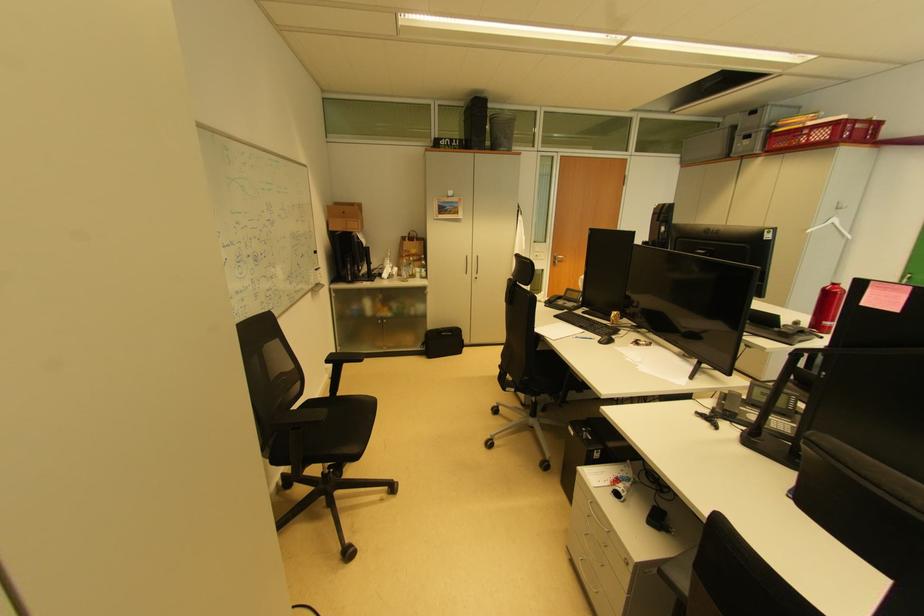
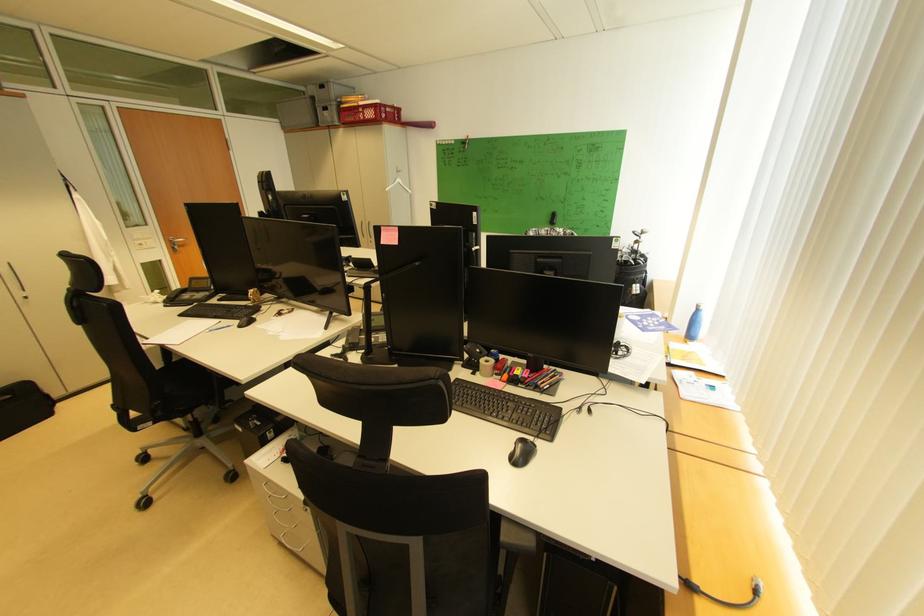
Locate, in the second image, the point that corresponds to the point at 554,304 in the first image.

(174, 302)